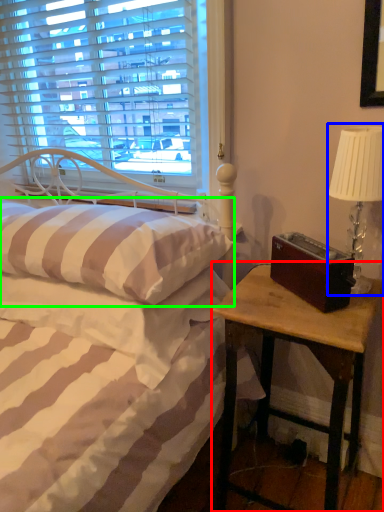
Question: Which is farther away from nightstand (highlighted by a red box)? table lamp (highlighted by a blue box) or pillow (highlighted by a green box)?

Choices:
 (A) table lamp
 (B) pillow

Answer: (B)